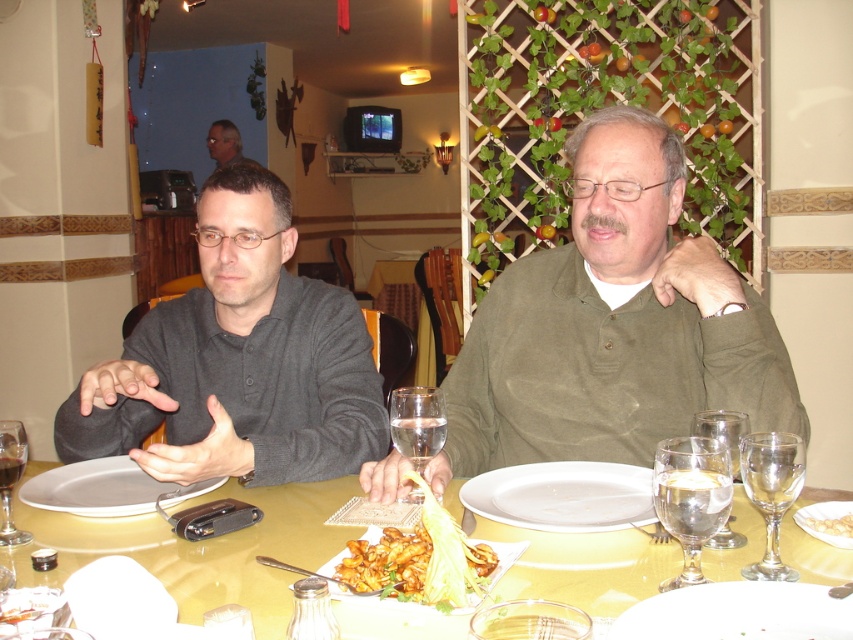
You are a server at the restaurant and need to place a new drink order for the dark gray shirt at left and the clear glass water at table center. Based on the size of their current items, which person might need a larger drink?

The dark gray shirt at left might need a larger drink since their current item is wider than the clear glass water at table center.

You are standing at the entrance of the restaurant and see the table with two people. There is a point at coordinates (612, 324). Which person is this point closer to?

The point at coordinates (612, 324) is on the green matte shirt at center, so it is closer to the individual on the right wearing a green sweater.

You are sitting at the table in the image and want to reach for an item located at point (366, 554). Is this point closer to you than the other point (433, 394)?

Yes, the point (366, 554) is in front of point (433, 394), so it is closer to you.